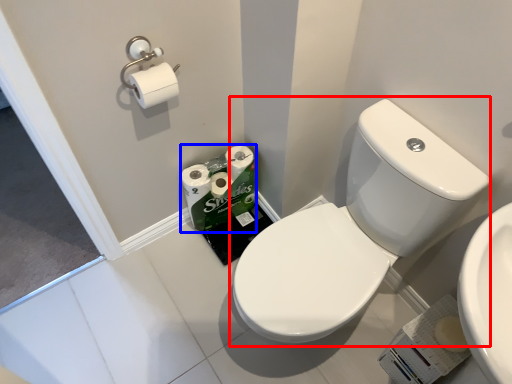
Question: Which object is further to the camera taking this photo, sink (highlighted by a red box) or toilet paper (highlighted by a blue box)?

Choices:
 (A) sink
 (B) toilet paper

Answer: (B)